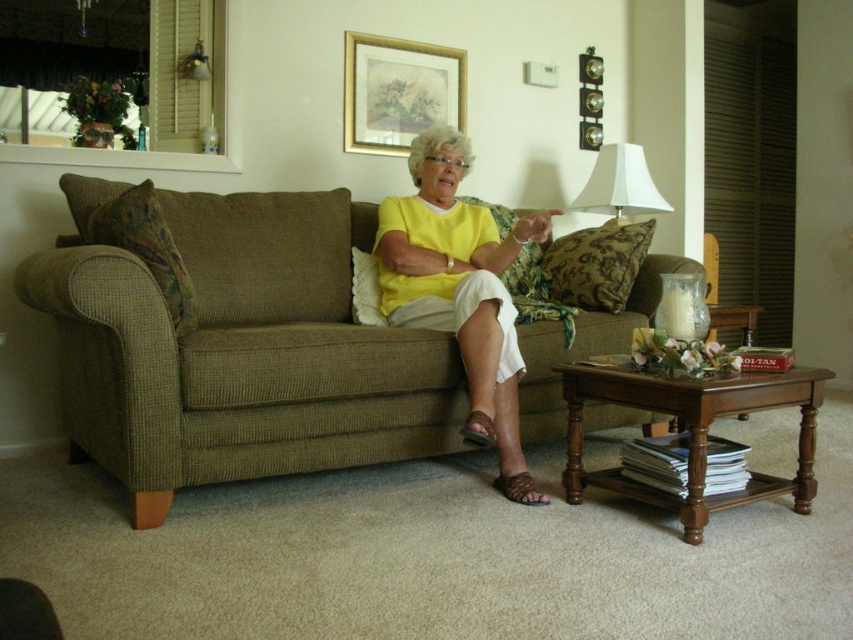
Which is behind, point (91, 433) or point (633, 154)?

The point (633, 154) is behind.

Is green textured couch at center shorter than white fabric lampshade at upper right?

In fact, green textured couch at center may be taller than white fabric lampshade at upper right.

The height and width of the screenshot is (640, 853). Describe the element at coordinates (238, 352) in the screenshot. I see `green textured couch at center` at that location.

At what (x,y) coordinates should I click in order to perform the action: click on green textured couch at center. Please return your answer as a coordinate pair (x, y). The width and height of the screenshot is (853, 640). Looking at the image, I should click on [238, 352].

Is point (303, 454) positioned after point (486, 420)?

No, (303, 454) is closer to viewer.

The width and height of the screenshot is (853, 640). Find the location of `green textured couch at center`. green textured couch at center is located at coordinates (238, 352).

What do you see at coordinates (398, 92) in the screenshot?
I see `gold-framed artwork at upper center` at bounding box center [398, 92].

The width and height of the screenshot is (853, 640). Identify the location of gold-framed artwork at upper center. (398, 92).

The image size is (853, 640). In order to click on gold-framed artwork at upper center in this screenshot , I will do `click(398, 92)`.